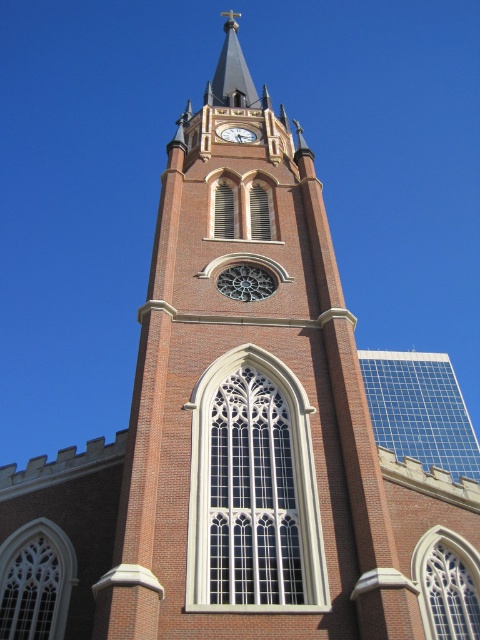
Between smooth gray steeple at upper center and white glossy clock at upper center, which one appears on the right side from the viewer's perspective?

white glossy clock at upper center is more to the right.

Does smooth gray steeple at upper center have a greater height compared to white glossy clock at upper center?

Yes, smooth gray steeple at upper center is taller than white glossy clock at upper center.

Who is more forward, (228,92) or (238,125)?

Point (238,125) is more forward.

This screenshot has height=640, width=480. Identify the location of smooth gray steeple at upper center. (x=231, y=72).